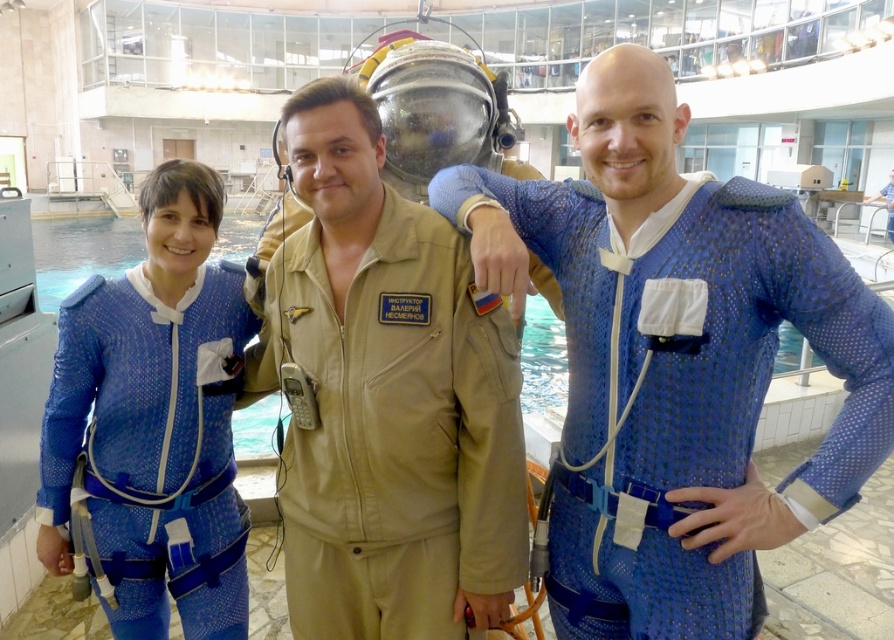
Does blue textured jumpsuit at center have a lesser width compared to tan fabric jumpsuit at center?

In fact, blue textured jumpsuit at center might be wider than tan fabric jumpsuit at center.

Does blue textured jumpsuit at center appear over tan fabric jumpsuit at center?

Yes.

The image size is (894, 640). Describe the element at coordinates (684, 387) in the screenshot. I see `blue textured jumpsuit at center` at that location.

Find the location of a particular element. The height and width of the screenshot is (640, 894). blue textured jumpsuit at center is located at coordinates (684, 387).

Describe the element at coordinates (392, 432) in the screenshot. I see `tan fabric jumpsuit at center` at that location.

Identify the location of tan fabric jumpsuit at center. (392, 432).

Who is taller, blue textured jumpsuit at center or blue mesh suit at left?

With more height is blue textured jumpsuit at center.

What do you see at coordinates (684, 387) in the screenshot? I see `blue textured jumpsuit at center` at bounding box center [684, 387].

Identify the location of blue textured jumpsuit at center. (684, 387).